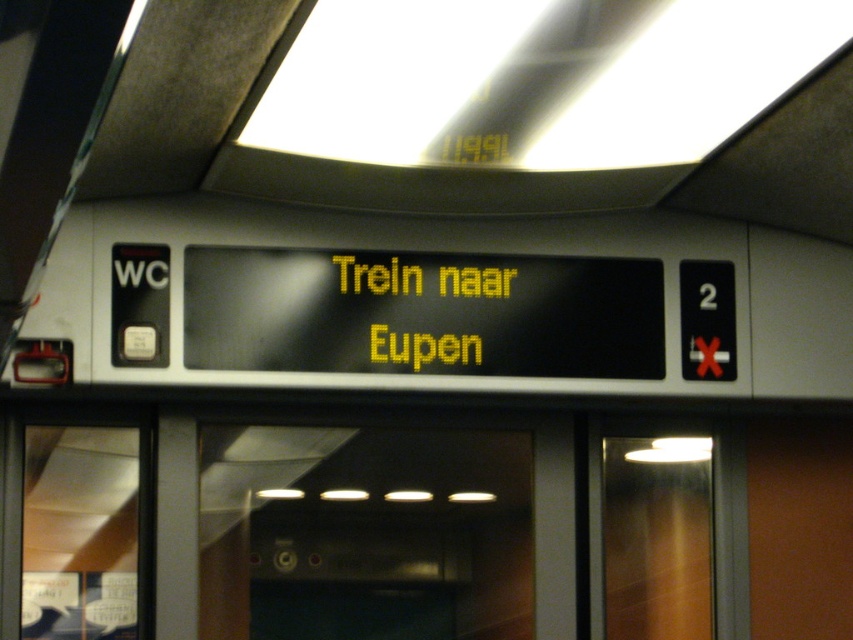
Question: Estimate the real-world distances between objects in this image. Which object is farther from the transparent glass door at center?

Choices:
 (A) transparent glass door at right
 (B) yellow led text at center

Answer: (B)

Question: Which object is positioned farthest from the transparent glass door at right?

Choices:
 (A) transparent glass door at center
 (B) yellow led text at center

Answer: (B)

Question: Does transparent glass door at center appear on the left side of transparent glass door at right?

Choices:
 (A) yes
 (B) no

Answer: (A)

Question: Does transparent glass door at right appear over yellow led text at center?

Choices:
 (A) no
 (B) yes

Answer: (A)

Question: Does transparent glass door at center have a lesser width compared to transparent glass door at right?

Choices:
 (A) no
 (B) yes

Answer: (A)

Question: Which point is farther from the camera taking this photo?

Choices:
 (A) (605, 440)
 (B) (341, 278)

Answer: (A)